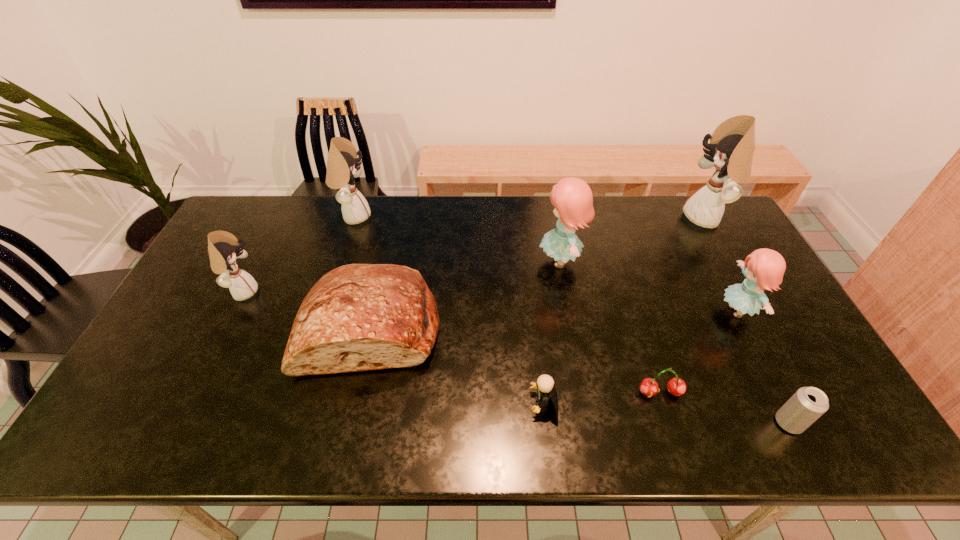
Locate an element on the screen. beer can is located at coordinates (807, 404).

Identify the location of Lego. (545, 383).

You are a GUI agent. You are given a task and a screenshot of the screen. Output one action in this format:
    pyautogui.click(x=<x>, y=<y>)
    Task: Click on the cherry
    Image resolution: width=960 pixels, height=540 pixels.
    Given the screenshot: What is the action you would take?
    pyautogui.click(x=649, y=387)

At what (x,y) coordinates should I click in order to perform the action: click on red cherry. Please return your answer as a coordinate pair (x, y). Image resolution: width=960 pixels, height=540 pixels. Looking at the image, I should click on (649, 387).

Find the location of a particular element. vacant space situated 0.290m at the front face of the rightmost black doll is located at coordinates (601, 218).

This screenshot has height=540, width=960. I want to click on free space located at the front face of the rightmost black doll, so click(646, 218).

In order to click on free space located 0.230m at the front face of the rightmost black doll in this screenshot , I will do `click(618, 218)`.

Where is `vacant region located 0.200m at the front face of the second black doll from left to right`? vacant region located 0.200m at the front face of the second black doll from left to right is located at coordinates (428, 216).

Where is `vacant region located 0.070m on the front-facing side of the bigger blue doll`? This screenshot has height=540, width=960. vacant region located 0.070m on the front-facing side of the bigger blue doll is located at coordinates (516, 261).

At what (x,y) coordinates should I click in order to perform the action: click on blank area located 0.150m on the front-facing side of the bigger blue doll. Please return your answer as a coordinate pair (x, y). Looking at the image, I should click on (491, 261).